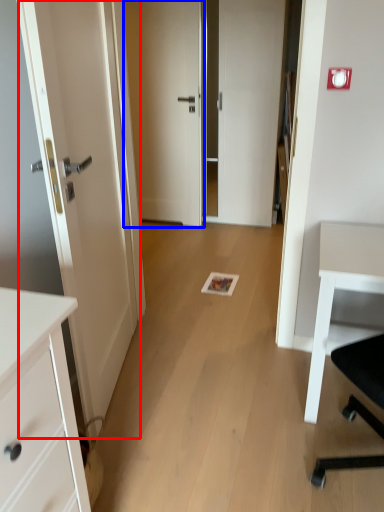
Question: Among these objects, which one is nearest to the camera, door (highlighted by a red box) or door (highlighted by a blue box)?

Choices:
 (A) door
 (B) door

Answer: (A)